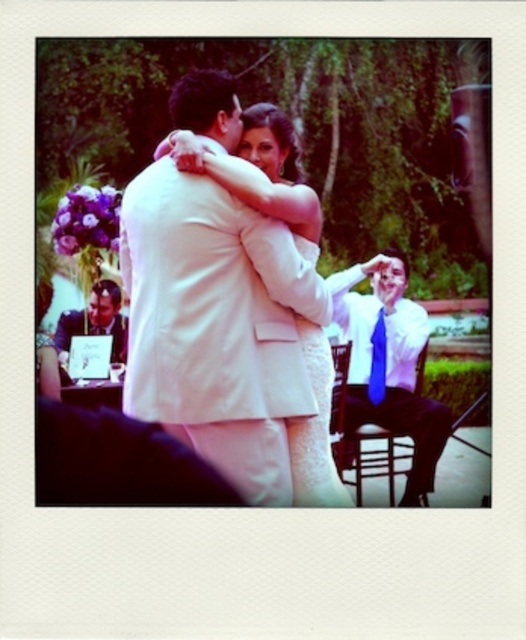
Describe the element at coordinates (259, 172) in the screenshot. I see `white satin dress at center` at that location.

Is white satin dress at center shorter than white textured dress at center?

Incorrect, white satin dress at center's height does not fall short of white textured dress at center's.

What do you see at coordinates (259, 172) in the screenshot? I see `white satin dress at center` at bounding box center [259, 172].

At what (x,y) coordinates should I click in order to perform the action: click on white satin dress at center. Please return your answer as a coordinate pair (x, y). Looking at the image, I should click on [259, 172].

Measure the distance from blue silk tie at right to matte white suit at left.

blue silk tie at right is 17.15 meters away from matte white suit at left.

Does blue silk tie at right have a lesser height compared to matte white suit at left?

No, blue silk tie at right is not shorter than matte white suit at left.

Is point (352, 355) in front of point (116, 333)?

Yes, point (352, 355) is in front of point (116, 333).

Locate an element on the screen. The width and height of the screenshot is (526, 640). blue silk tie at right is located at coordinates (389, 364).

Does white satin dress at center come in front of blue satin tie at right?

Yes, it is.

At what (x,y) coordinates should I click in order to perform the action: click on white satin dress at center. Please return your answer as a coordinate pair (x, y). This screenshot has width=526, height=640. Looking at the image, I should click on (259, 172).

Find the location of a particular element. white satin dress at center is located at coordinates (259, 172).